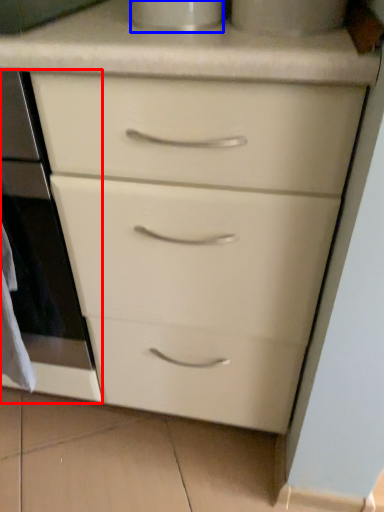
Question: Which object is closer to the camera taking this photo, oven (highlighted by a red box) or appliance (highlighted by a blue box)?

Choices:
 (A) oven
 (B) appliance

Answer: (B)